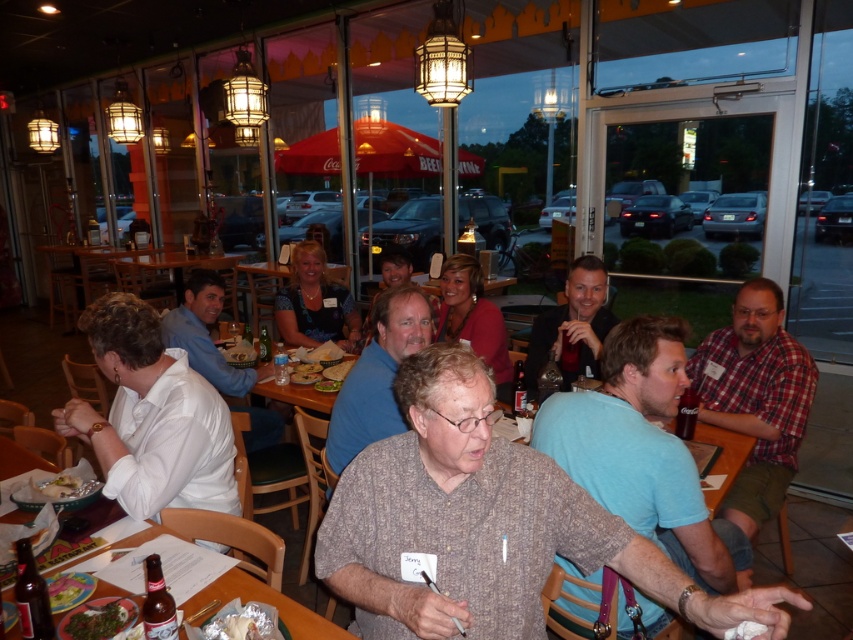
Who is lower down, wooden table at center or green leafy salad at center?

wooden table at center

Does wooden table at center come behind green leafy salad at center?

No, it is in front of green leafy salad at center.

Is point (311, 632) behind point (329, 380)?

No, (311, 632) is closer to viewer.

The width and height of the screenshot is (853, 640). Find the location of `wooden table at center`. wooden table at center is located at coordinates (270, 604).

Can you confirm if plaid fabric shirt at right is smaller than matte black shirt at center?

No.

Does plaid fabric shirt at right come behind matte black shirt at center?

No, it is in front of matte black shirt at center.

Between point (795, 376) and point (570, 362), which one is positioned in front?

Positioned in front is point (795, 376).

Locate an element on the screen. The width and height of the screenshot is (853, 640). plaid fabric shirt at right is located at coordinates (755, 397).

Between light blue shirt at center and green leafy salad at lower left, which one appears on the left side from the viewer's perspective?

From the viewer's perspective, green leafy salad at lower left appears more on the left side.

Does point (630, 458) come behind point (73, 602)?

Yes, it is behind point (73, 602).

Is point (730, 566) in front of point (76, 593)?

No.

Where is `light blue shirt at center`? The width and height of the screenshot is (853, 640). light blue shirt at center is located at coordinates (643, 451).